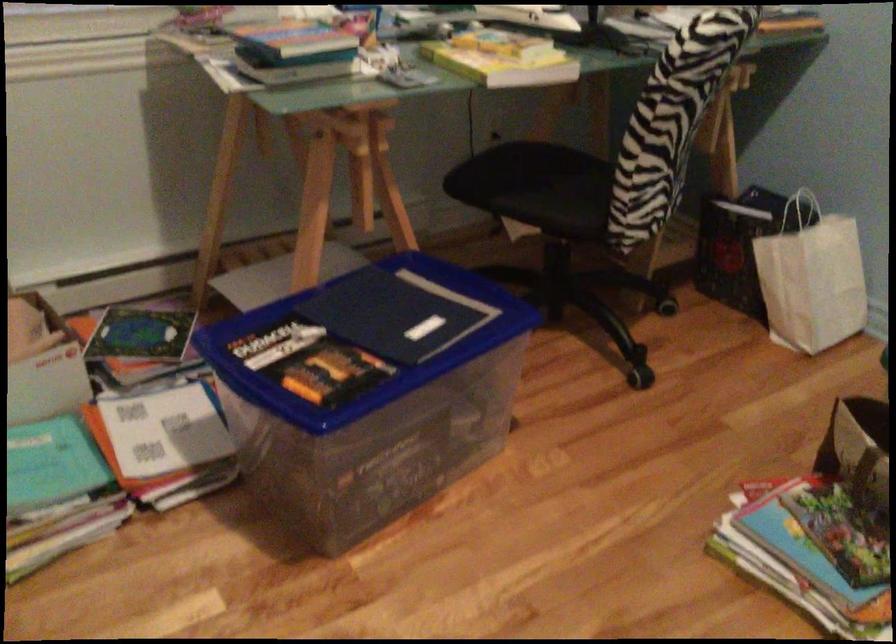
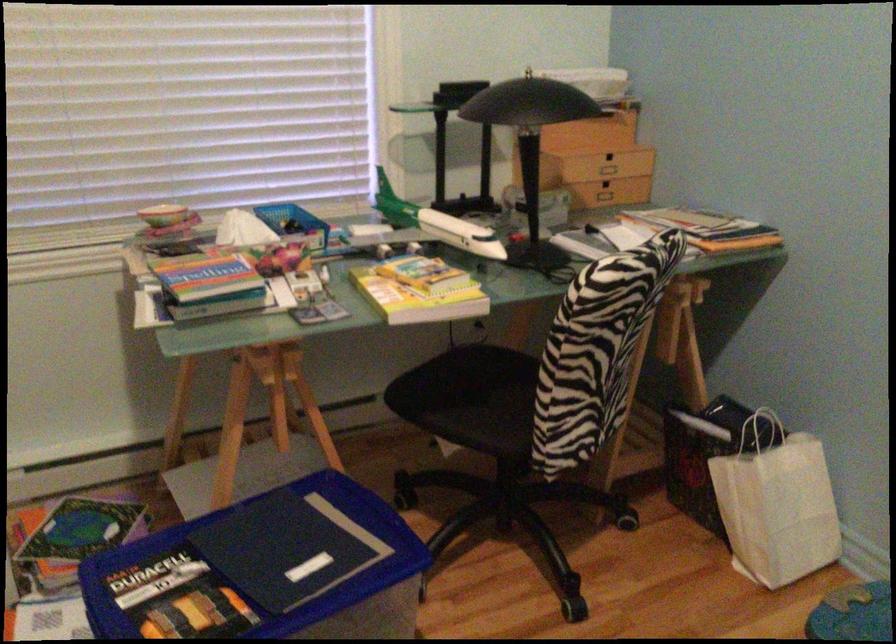
The point at (541, 167) is marked in the first image. Where is the corresponding point in the second image?

(487, 377)